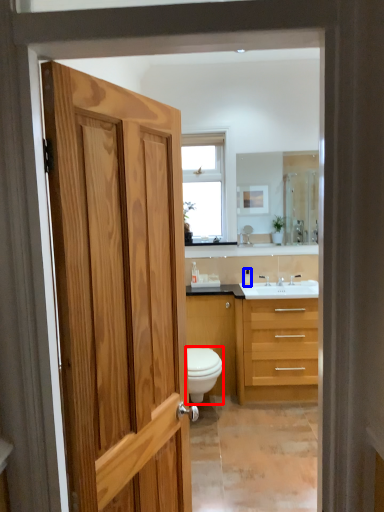
Question: Which object is closer to the camera taking this photo, toilet (highlighted by a red box) or toiletry (highlighted by a blue box)?

Choices:
 (A) toilet
 (B) toiletry

Answer: (A)